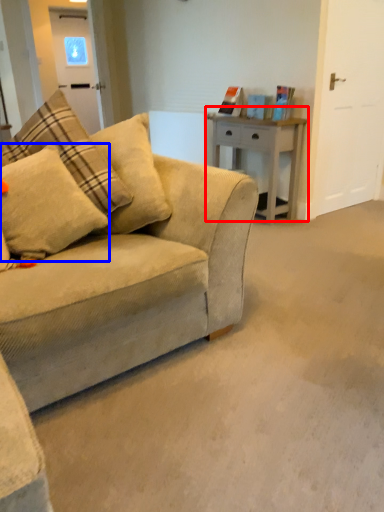
Question: Which object is further to the camera taking this photo, table (highlighted by a red box) or pillow (highlighted by a blue box)?

Choices:
 (A) table
 (B) pillow

Answer: (A)